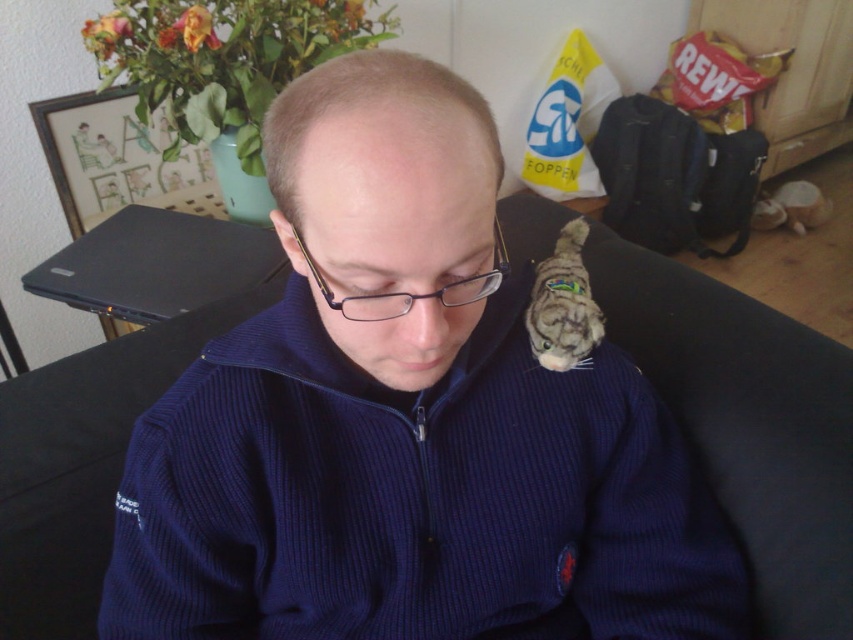
Question: Among these objects, which one is farthest from the camera?

Choices:
 (A) blue corduroy head at center
 (B) navy corduroy sweater at center
 (C) fuzzy gray cat at center

Answer: (C)

Question: Which of the following is the farthest from the observer?

Choices:
 (A) (534, 316)
 (B) (340, 161)
 (C) (231, 589)

Answer: (A)

Question: Does navy corduroy sweater at center have a lesser width compared to blue corduroy head at center?

Choices:
 (A) yes
 (B) no

Answer: (B)

Question: Is the position of navy corduroy sweater at center more distant than that of blue corduroy head at center?

Choices:
 (A) no
 (B) yes

Answer: (B)

Question: Which of the following is the closest to the observer?

Choices:
 (A) pos(560,326)
 (B) pos(323,140)
 (C) pos(514,310)

Answer: (B)

Question: Is blue corduroy head at center above fuzzy gray cat at center?

Choices:
 (A) yes
 (B) no

Answer: (A)